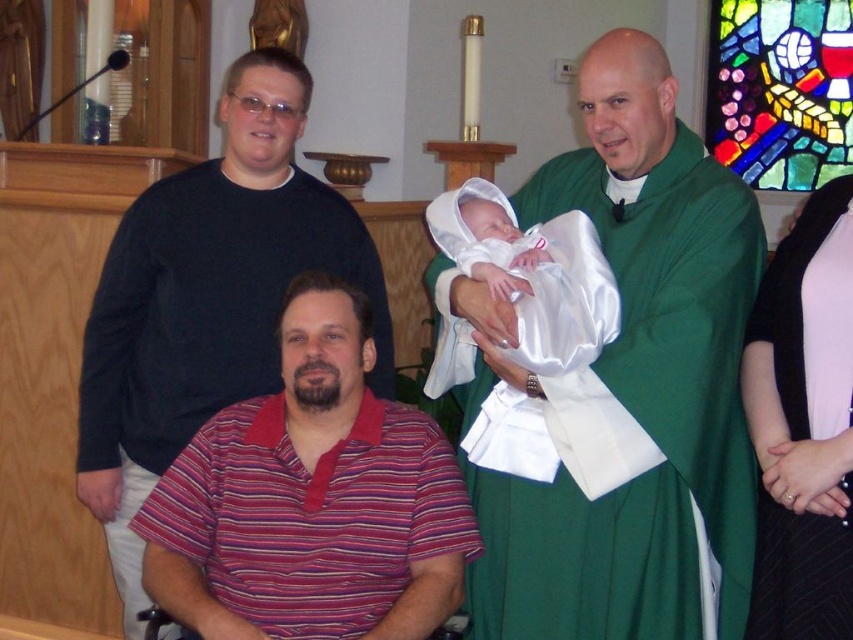
Question: Which point is closer to the camera?

Choices:
 (A) white satin baby at center
 (B) green satin robe at center

Answer: (B)

Question: Can you confirm if striped polo shirt at lower left is positioned to the right of pink satin dress at right?

Choices:
 (A) yes
 (B) no

Answer: (B)

Question: Which object is farther from the camera taking this photo?

Choices:
 (A) green satin robe at center
 (B) black matte shirt at upper left
 (C) striped polo shirt at lower left

Answer: (B)

Question: Where is striped polo shirt at lower left located in relation to black matte shirt at upper left in the image?

Choices:
 (A) right
 (B) left

Answer: (A)

Question: Which object is positioned closest to the pink satin dress at right?

Choices:
 (A) green satin robe at center
 (B) white satin baby at center
 (C) striped polo shirt at lower left

Answer: (A)

Question: Is striped polo shirt at lower left further to camera compared to pink satin dress at right?

Choices:
 (A) no
 (B) yes

Answer: (A)